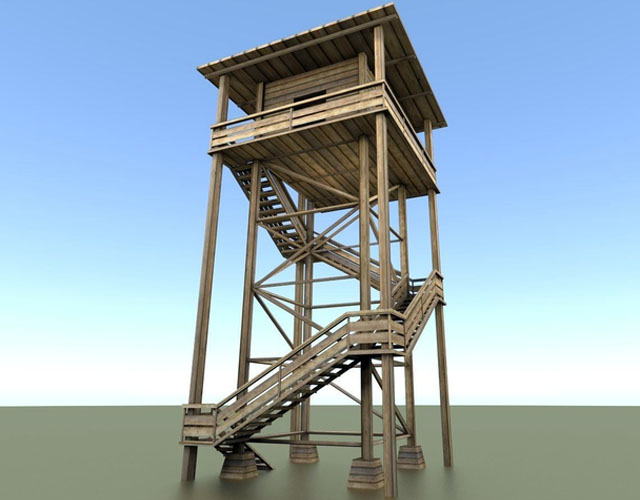
The height and width of the screenshot is (500, 640). Find the location of `staircase railings`. staircase railings is located at coordinates [x=196, y=403], [x=249, y=379], [x=370, y=308], [x=397, y=310], [x=413, y=297], [x=435, y=270], [x=416, y=285], [x=380, y=261], [x=292, y=200].